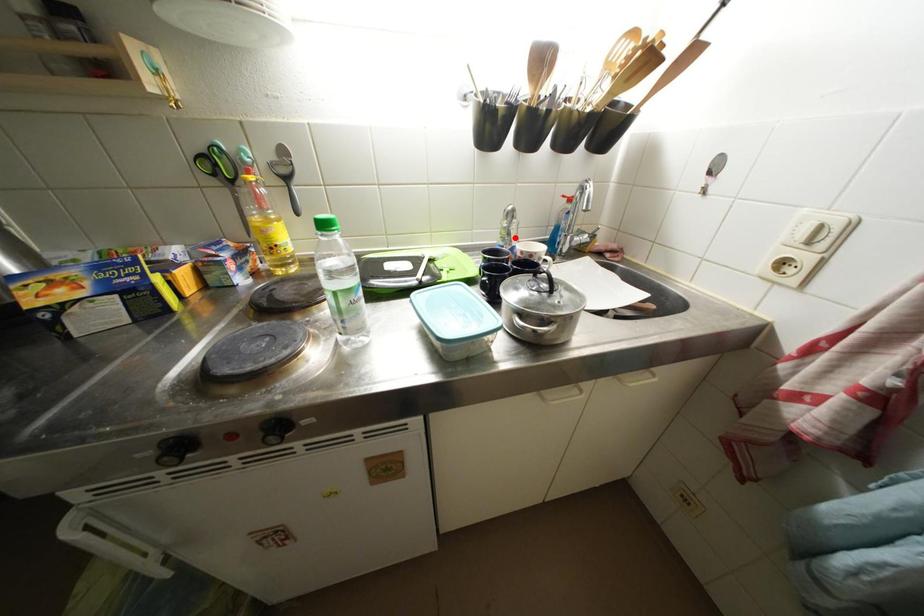
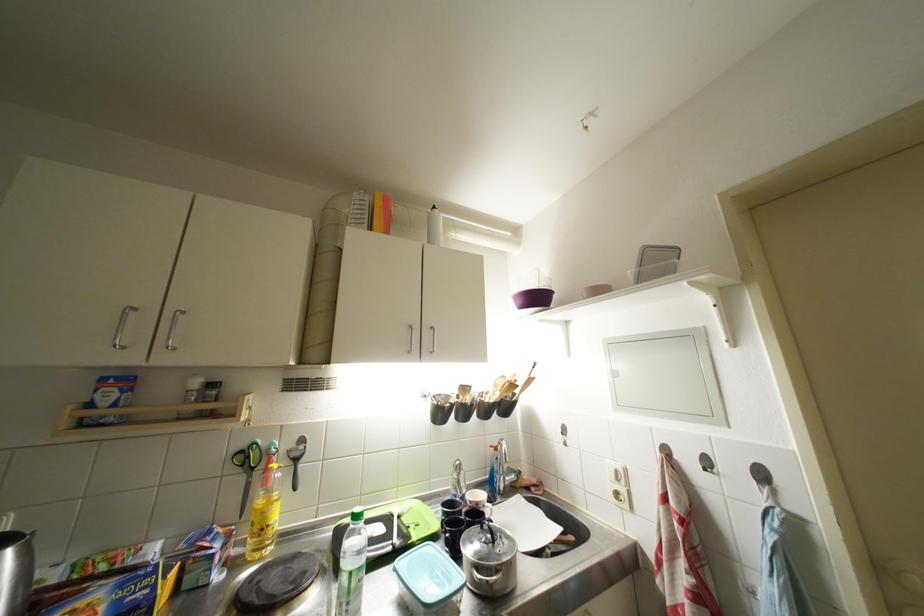
Find the pixel in the second image that matches the highlighted location in the first image.

(466, 487)